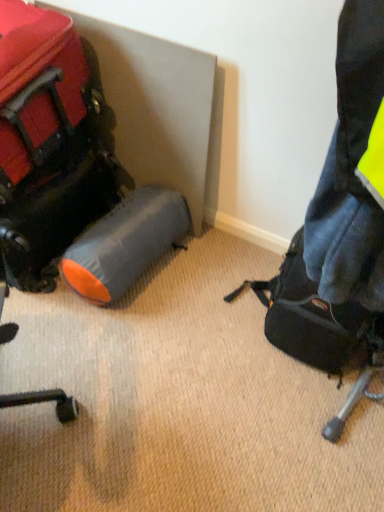
Question: Choose the correct answer: Is matte black backpack at right, the 1th luggage and bags positioned from the right, inside gray fabric sleeping bag at lower left or outside it?

Choices:
 (A) inside
 (B) outside

Answer: (B)

Question: Is matte black backpack at right, the 1th luggage and bags positioned from the right, in front of or behind gray fabric sleeping bag at lower left in the image?

Choices:
 (A) behind
 (B) front

Answer: (B)

Question: Which of these objects is positioned farthest from the gray fabric sleeping bag at lower left?

Choices:
 (A) matte black backpack at right, the 1th luggage and bags positioned from the right
 (B) matte black suitcase at left, which ranks as the 2th luggage and bags in right-to-left order

Answer: (A)

Question: Estimate the real-world distances between objects in this image. Which object is closer to the matte black backpack at right, positioned as the 2th luggage and bags in left-to-right order?

Choices:
 (A) matte black suitcase at left, marked as the first luggage and bags in a left-to-right arrangement
 (B) gray fabric sleeping bag at lower left

Answer: (B)